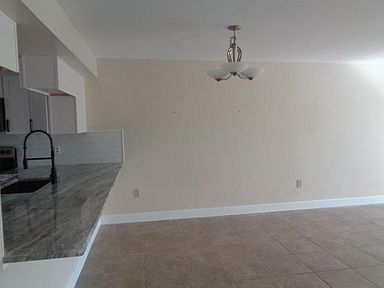
Find the location of a particular element. This screenshot has height=288, width=384. ceiling is located at coordinates (165, 40).